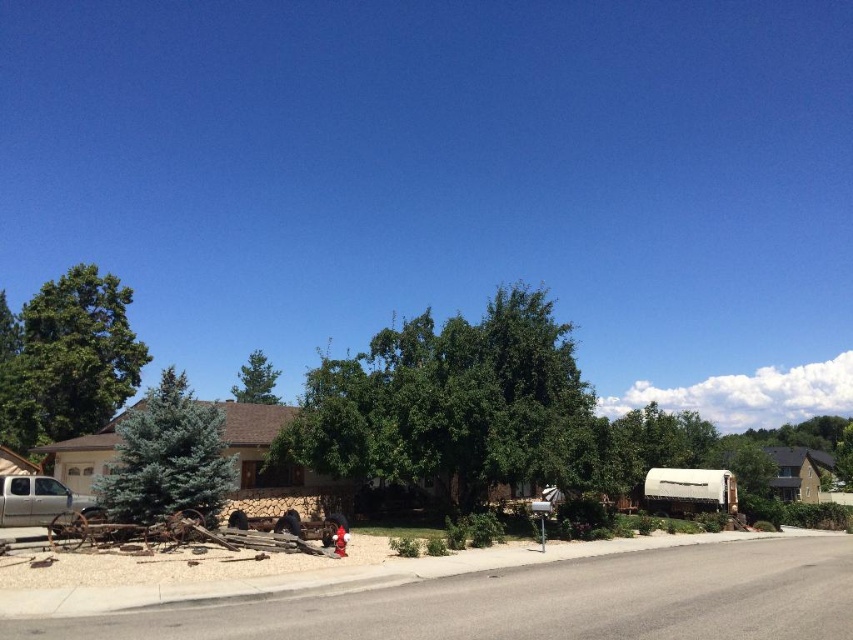
Can you confirm if blue-green coniferous tree at left is thinner than green leafy tree at upper center?

Yes, blue-green coniferous tree at left is thinner than green leafy tree at upper center.

Is point (187, 483) farther from camera compared to point (271, 403)?

That is False.

Is point (177, 406) closer to camera compared to point (271, 397)?

Yes, point (177, 406) is in front of point (271, 397).

Where is `blue-green coniferous tree at left`? The width and height of the screenshot is (853, 640). blue-green coniferous tree at left is located at coordinates (167, 458).

In the scene shown: Can you confirm if green leafy tree at center is positioned below silver metallic truck at lower left?

Actually, green leafy tree at center is above silver metallic truck at lower left.

Who is more forward, (515, 346) or (16, 516)?

Point (16, 516)

In order to click on green leafy tree at center in this screenshot , I will do `click(451, 404)`.

This screenshot has height=640, width=853. What are the coordinates of `green leafy tree at center` in the screenshot? It's located at (451, 404).

Based on the photo, can you confirm if green leafy tree at center is smaller than green leafy tree at upper center?

No, green leafy tree at center is not smaller than green leafy tree at upper center.

Does point (514, 340) come farther from viewer compared to point (252, 369)?

That is False.

This screenshot has height=640, width=853. I want to click on green leafy tree at center, so click(451, 404).